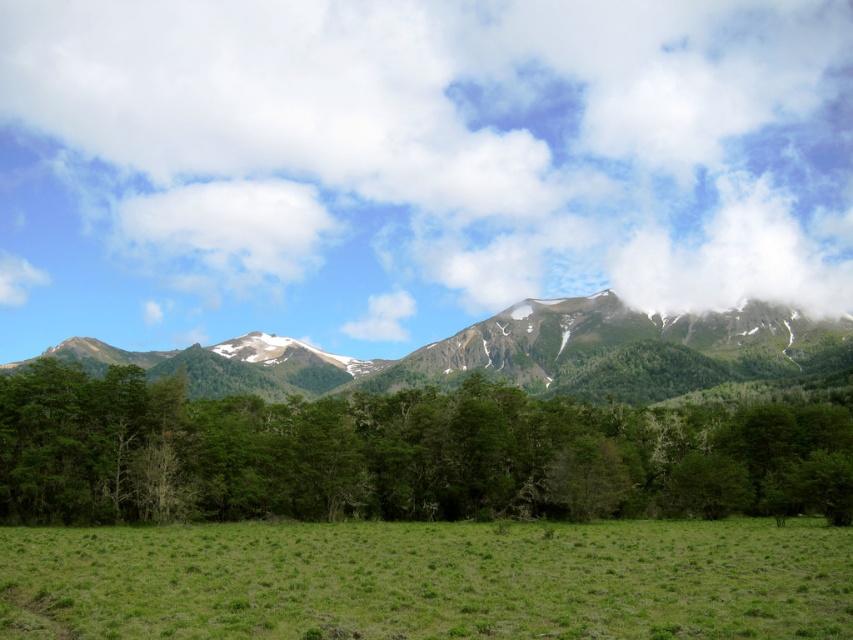
You are a hiker planning to take a photo of the green textured mountain range at center from the white fluffy cloud at upper center. Considering the distance between them, do you think you can capture both in a single frame without moving the camera?

The white fluffy cloud at upper center and green textured mountain range at center are 183.99 meters apart. Since the distance is significant, capturing both in a single frame without moving the camera would require a wide enough lens to encompass the entire 183.99 meters between them.